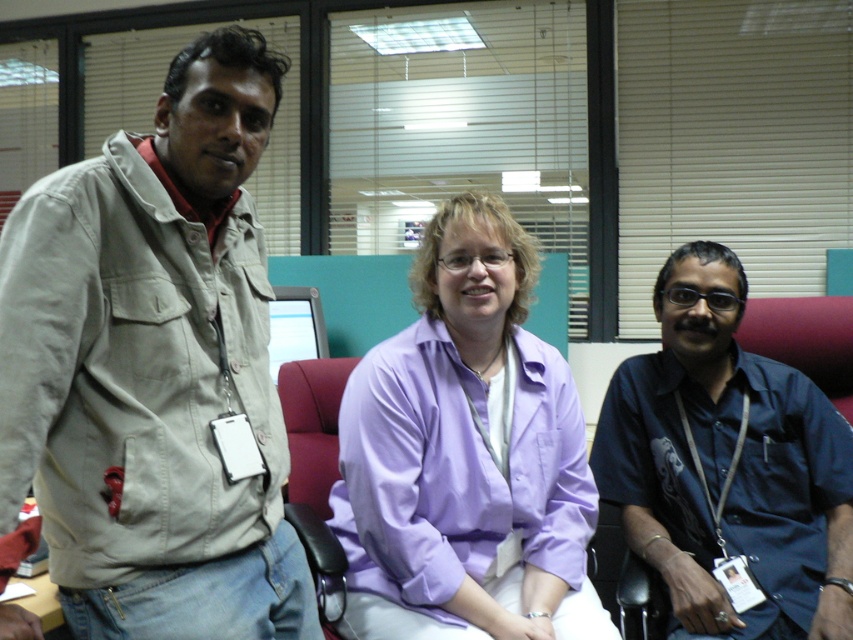
Question: Which object appears farthest from the camera in this image?

Choices:
 (A) dark blue shirt at center
 (B) purple cotton shirt at center
 (C) beige cotton jacket at left

Answer: (A)

Question: Which point appears closest to the camera in this image?

Choices:
 (A) (491, 493)
 (B) (218, 556)

Answer: (B)

Question: Considering the relative positions of beige cotton jacket at left and dark blue shirt at center in the image provided, where is beige cotton jacket at left located with respect to dark blue shirt at center?

Choices:
 (A) below
 (B) above

Answer: (B)

Question: Is purple cotton shirt at center further to the viewer compared to dark blue shirt at center?

Choices:
 (A) yes
 (B) no

Answer: (B)

Question: Can you confirm if beige cotton jacket at left is bigger than purple cotton shirt at center?

Choices:
 (A) no
 (B) yes

Answer: (A)

Question: Which of the following is the farthest from the observer?

Choices:
 (A) purple cotton shirt at center
 (B) dark blue shirt at center
 (C) beige cotton jacket at left

Answer: (B)